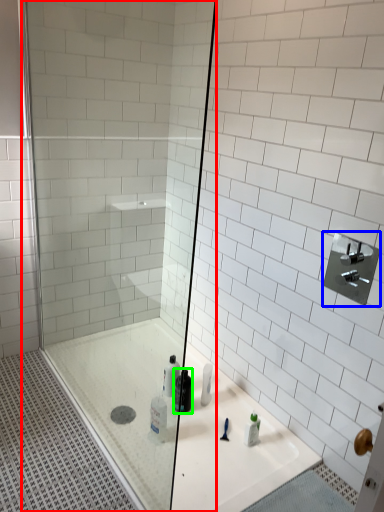
Question: Which object is positioned closest to shower door (highlighted by a red box)? Select from shower (highlighted by a blue box) and mouthwash (highlighted by a green box).

Choices:
 (A) shower
 (B) mouthwash

Answer: (B)